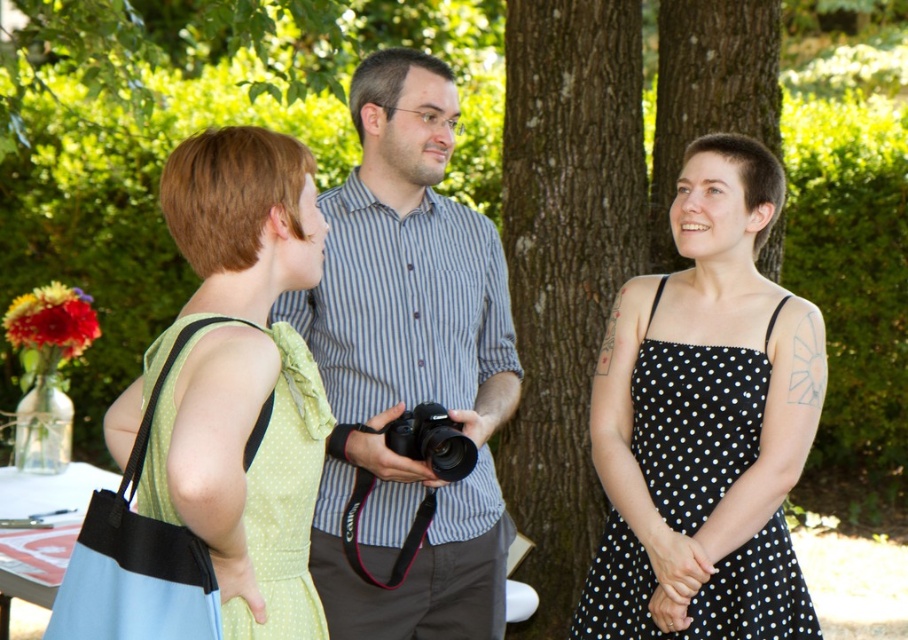
Question: Which point is closer to the camera taking this photo?

Choices:
 (A) (425, 406)
 (B) (277, 342)
 (C) (643, 348)
 (D) (522, 481)

Answer: (B)

Question: Is brown rough bark tree at center positioned in front of black polka dot fabric dress at center?

Choices:
 (A) no
 (B) yes

Answer: (A)

Question: Which object appears farthest from the camera in this image?

Choices:
 (A) black plastic camera at center
 (B) striped cotton shirt at center
 (C) green polka dot fabric dress at left
 (D) black polka dot fabric dress at center

Answer: (D)

Question: In this image, where is black polka dot fabric dress at center located relative to green polka dot fabric dress at left?

Choices:
 (A) above
 (B) below

Answer: (B)

Question: Can you confirm if striped cotton shirt at center is smaller than green polka dot fabric dress at left?

Choices:
 (A) no
 (B) yes

Answer: (A)

Question: Which of the following is the closest to the observer?

Choices:
 (A) (561, 262)
 (B) (696, 348)
 (C) (285, 525)
 (D) (383, 188)

Answer: (C)